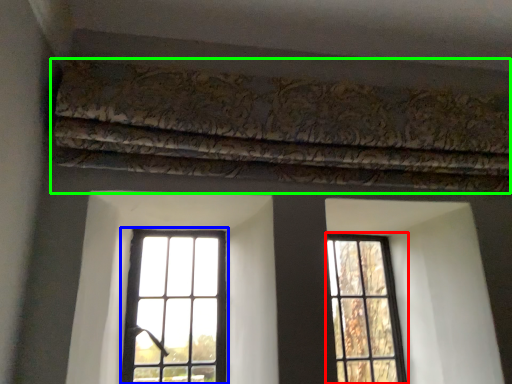
Question: Based on their relative distances, which object is nearer to window (highlighted by a red box)? Choose from window (highlighted by a blue box) and curtain (highlighted by a green box).

Choices:
 (A) window
 (B) curtain

Answer: (A)